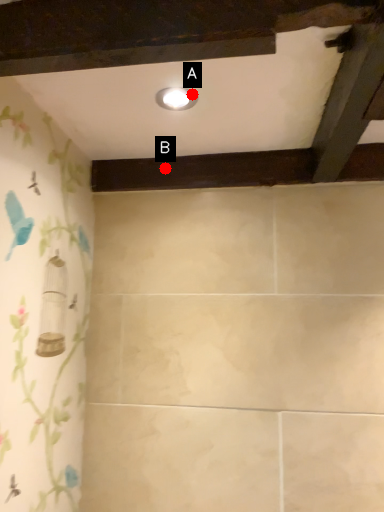
Question: Two points are circled on the image, labeled by A and B beside each circle. Which point is farther from the camera taking this photo?

Choices:
 (A) A is further
 (B) B is further

Answer: (B)